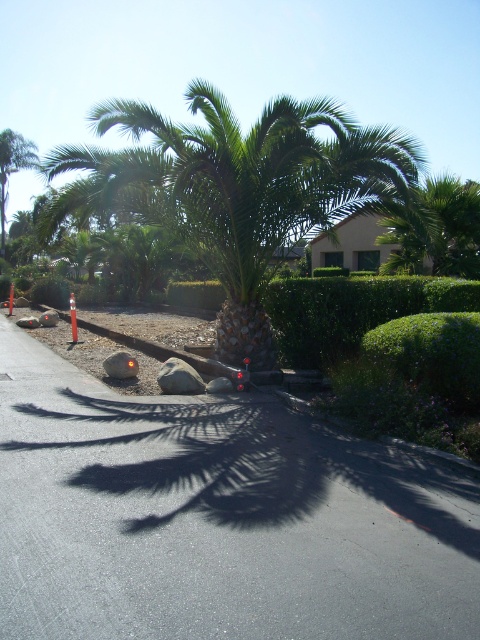
You are a gardener planning to install a new sprinkler system. You need to place a sprinkler head that can cover a radius of 5 meters. If you position it exactly at the asphalt at center, will it reach the gray rough rock at center?

The asphalt at center and gray rough rock at center are 6.22 meters apart. Since the sprinkler head can only cover 5 meters, it will not reach the gray rough rock at center.

You are a gardener planning to plant a new tree in the area. Given the sizes of the asphalt at center and the green leafy palm tree at center, which one is more suitable for accommodating a larger tree root system?

The green leafy palm tree at center is larger than asphalt at center, so it would be more suitable for accommodating a larger tree root system.